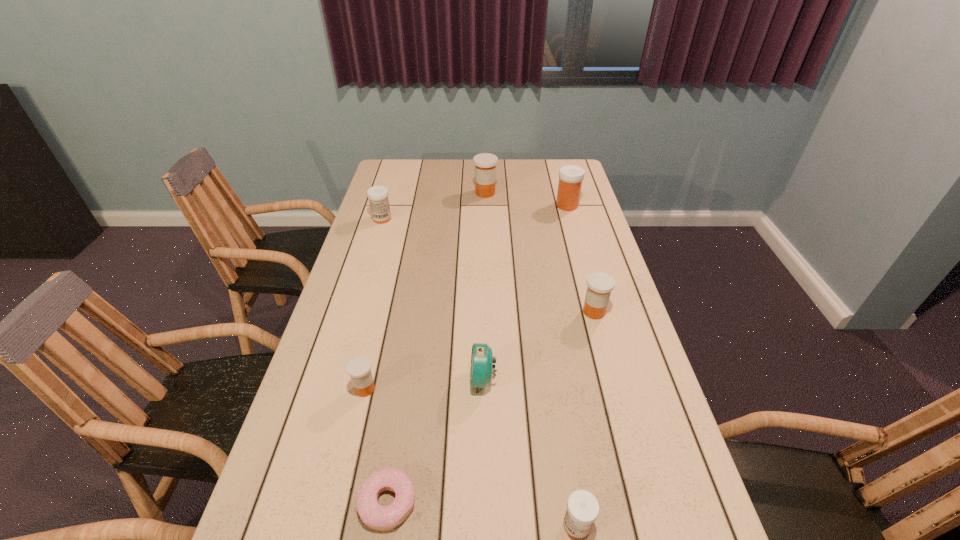
Find the location of a particular element. This screenshot has height=540, width=960. vacant space that is in between the leftmost object and the doughnut is located at coordinates (385, 360).

Identify the location of vacant space in between the biggest white medicine and the second nearest orange medicine. (581, 259).

You are a GUI agent. You are given a task and a screenshot of the screen. Output one action in this format:
    pyautogui.click(x=<x>, y=<y>)
    Task: Click on the vacant area that lies between the second farthest object and the smallest orange medicine
    
    Given the screenshot: What is the action you would take?
    pyautogui.click(x=466, y=297)

At what (x,y) coordinates should I click in order to perform the action: click on free space between the second orange medicine from right to left and the pink doughnut. Please return your answer as a coordinate pair (x, y). Image resolution: width=960 pixels, height=540 pixels. Looking at the image, I should click on (437, 347).

Identify the location of free point between the seventh nearest object and the smallest orange medicine. (466, 297).

Where is `free space between the third farthest medicine and the fourth farthest medicine`? This screenshot has height=540, width=960. free space between the third farthest medicine and the fourth farthest medicine is located at coordinates (488, 265).

This screenshot has height=540, width=960. Identify the location of free area in between the third medicine from left to right and the nearest orange medicine. (425, 291).

Identify which object is the seventh nearest to the alarm clock. Please provide its 2D coordinates. Your answer should be formatted as a tuple, i.e. [(x, y)], where the tuple contains the x and y coordinates of a point satisfying the conditions above.

[(485, 163)]

Locate which object ranks third in proximity to the fourth farthest medicine. Please provide its 2D coordinates. Your answer should be formatted as a tuple, i.e. [(x, y)], where the tuple contains the x and y coordinates of a point satisfying the conditions above.

[(582, 510)]

You are a GUI agent. You are given a task and a screenshot of the screen. Output one action in this format:
    pyautogui.click(x=<x>, y=<y>)
    Task: Click on the medicine identified as the fourth closest to the blue alarm clock
    This screenshot has width=960, height=540.
    Given the screenshot: What is the action you would take?
    coord(378,195)